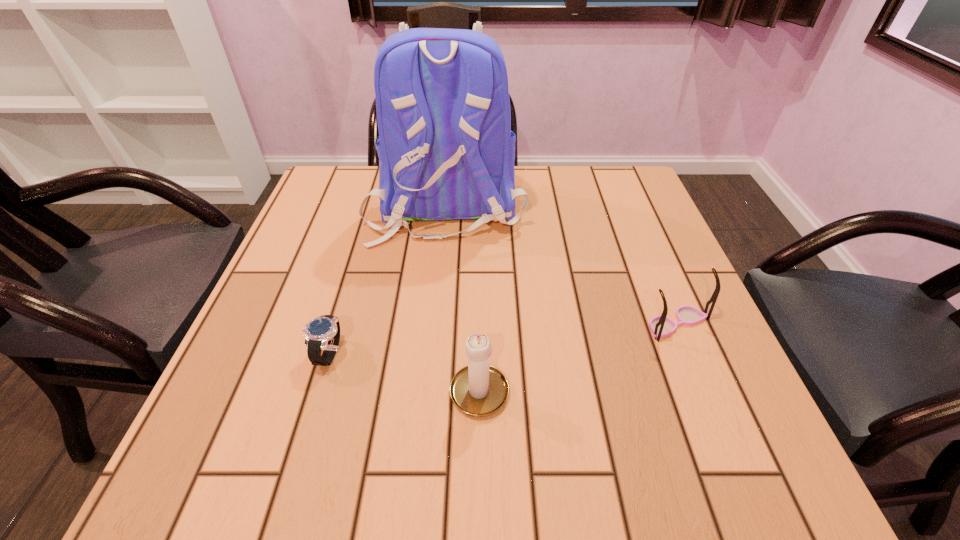
This screenshot has width=960, height=540. What are the coordinates of `free region at the far left corner of the desktop` in the screenshot? It's located at (343, 185).

In the image, there is a desktop. Where is `vacant space at the far right corner`? The height and width of the screenshot is (540, 960). vacant space at the far right corner is located at coordinates (626, 177).

Identify the location of vacant area at the near right corner. (665, 448).

The height and width of the screenshot is (540, 960). Identify the location of free space that is in between the spectacles and the candle holder. (578, 355).

At what (x,y) coordinates should I click in order to perform the action: click on vacant region between the backpack and the candle holder. Please return your answer as a coordinate pair (x, y). The image size is (960, 540). Looking at the image, I should click on (463, 296).

This screenshot has width=960, height=540. What are the coordinates of `vacant point located between the second shortest object and the third shortest object` in the screenshot? It's located at (578, 355).

Locate an element on the screen. The height and width of the screenshot is (540, 960). free space between the backpack and the rightmost object is located at coordinates (562, 264).

Identify the location of vacant area between the shortest object and the farthest object. The width and height of the screenshot is (960, 540). (387, 279).

In order to click on empty space that is in between the shortest object and the second shortest object in this screenshot , I will do `click(502, 339)`.

At what (x,y) coordinates should I click in order to perform the action: click on free space between the farthest object and the third tallest object. Please return your answer as a coordinate pair (x, y). Looking at the image, I should click on (562, 264).